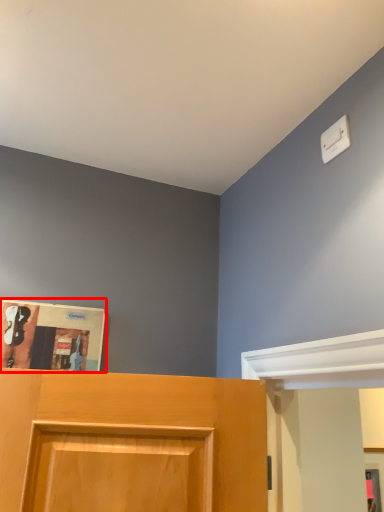
Question: Considering the relative positions of magazine (annotated by the red box) and light switch in the image provided, where is magazine (annotated by the red box) located with respect to the staircase?

Choices:
 (A) left
 (B) right

Answer: (A)